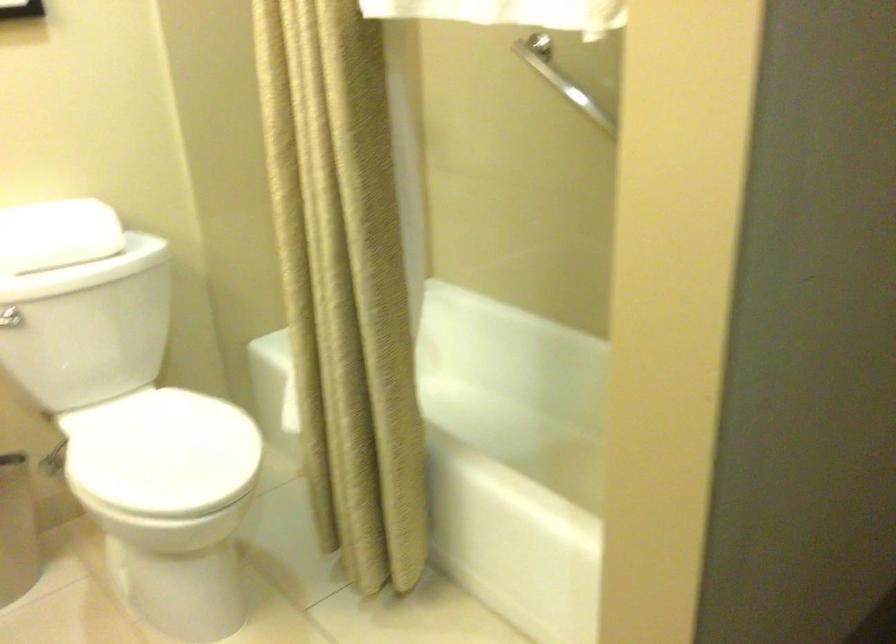
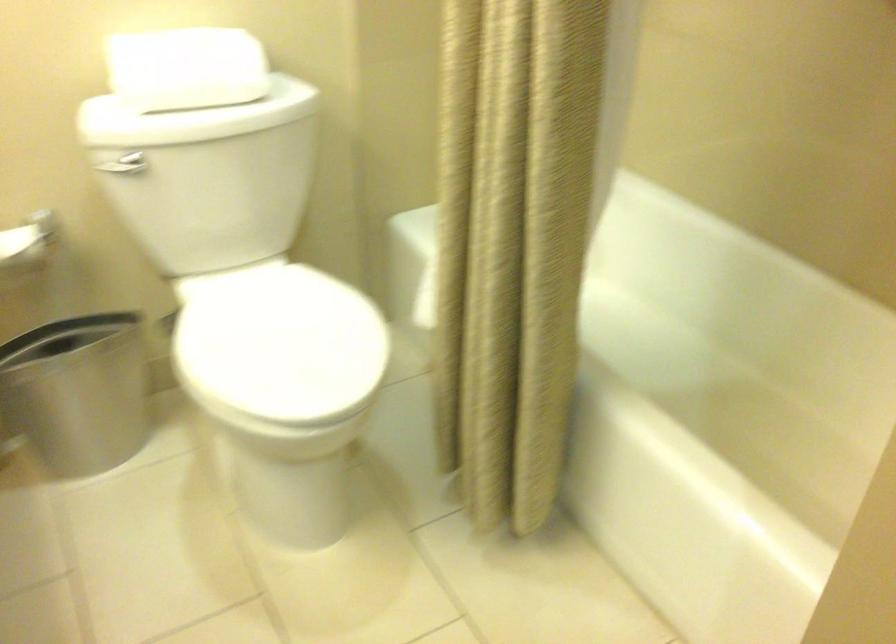
Question: The first image is from the beginning of the video and the second image is from the end. How did the camera likely rotate when shooting the video?

Choices:
 (A) Left
 (B) Right
 (C) Up
 (D) Down

Answer: (D)